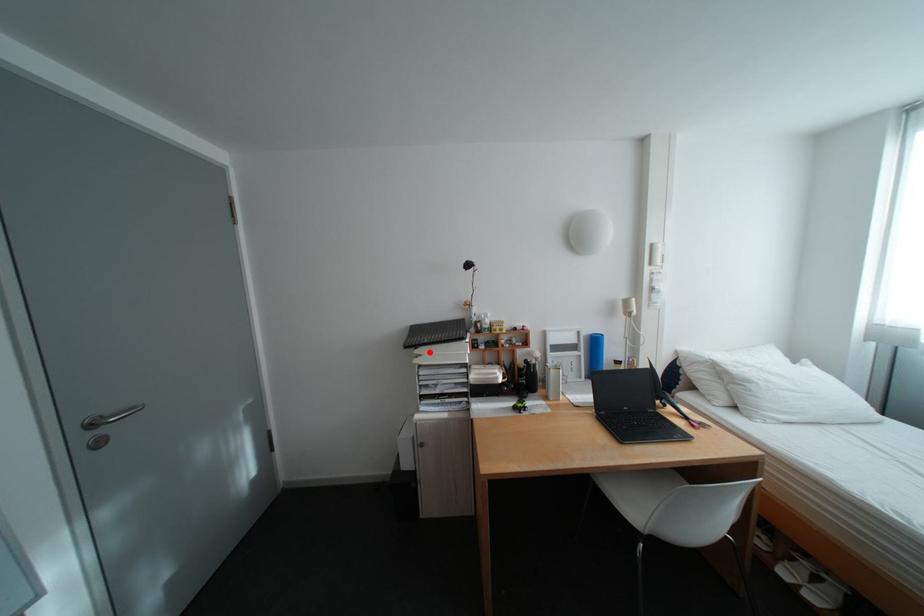
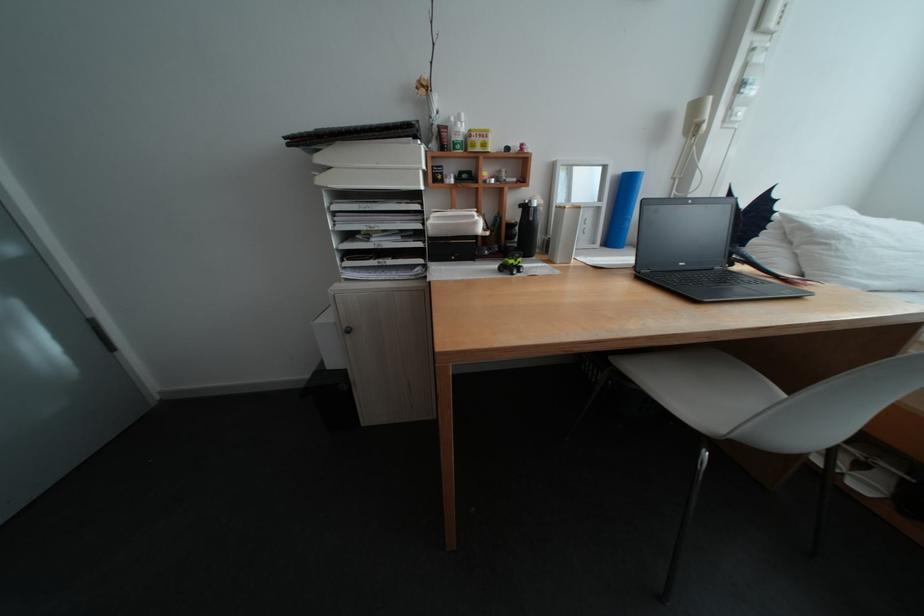
In the second image, find the point that corresponds to the highlighted location in the first image.

(333, 160)